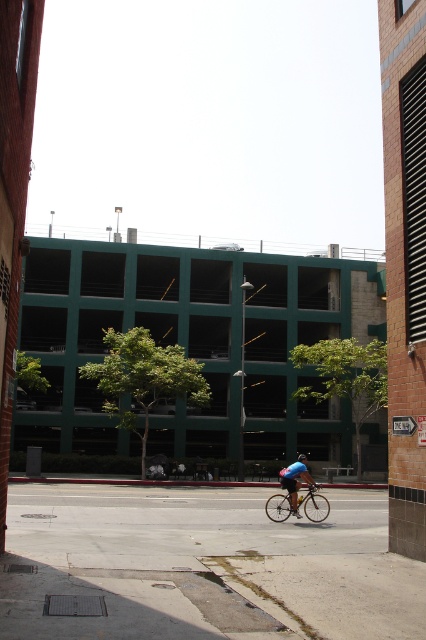
Question: Can you confirm if blue fabric cyclist at center is positioned to the left of blue matte bicycle helmet at center?

Choices:
 (A) no
 (B) yes

Answer: (B)

Question: Which object appears closest to the camera in this image?

Choices:
 (A) blue matte bicycle helmet at center
 (B) shiny silver bicycle at center
 (C) blue fabric cyclist at center
 (D) gray concrete pavement at center

Answer: (D)

Question: Does blue fabric cyclist at center lie in front of blue matte bicycle helmet at center?

Choices:
 (A) no
 (B) yes

Answer: (B)

Question: Which object is farther from the camera taking this photo?

Choices:
 (A) shiny silver bicycle at center
 (B) blue fabric cyclist at center
 (C) gray concrete pavement at center
 (D) blue matte bicycle helmet at center

Answer: (D)

Question: Where is gray concrete pavement at center located in relation to blue fabric cyclist at center in the image?

Choices:
 (A) below
 (B) above

Answer: (B)

Question: Which object is the closest to the shiny silver bicycle at center?

Choices:
 (A) blue fabric cyclist at center
 (B) blue matte bicycle helmet at center
 (C) gray concrete pavement at center

Answer: (A)